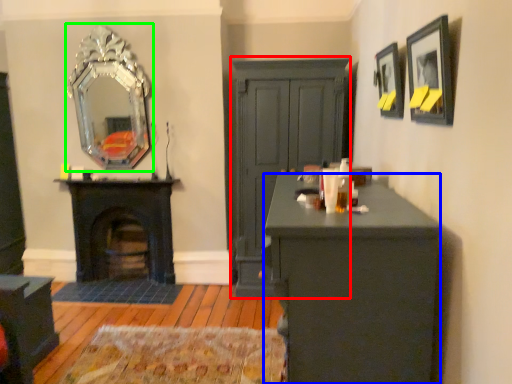
Question: Which is nearer to the dresser (highlighted by a red box)? desk (highlighted by a blue box) or mirror (highlighted by a green box).

Choices:
 (A) desk
 (B) mirror

Answer: (B)